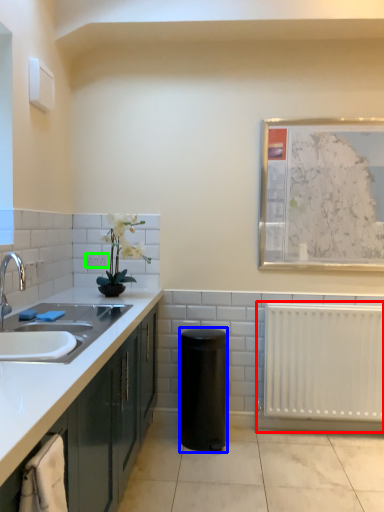
Question: Which object is positioned farthest from radiator (highlighted by a red box)? Select from appliance (highlighted by a blue box) and electric outlet (highlighted by a green box).

Choices:
 (A) appliance
 (B) electric outlet

Answer: (B)